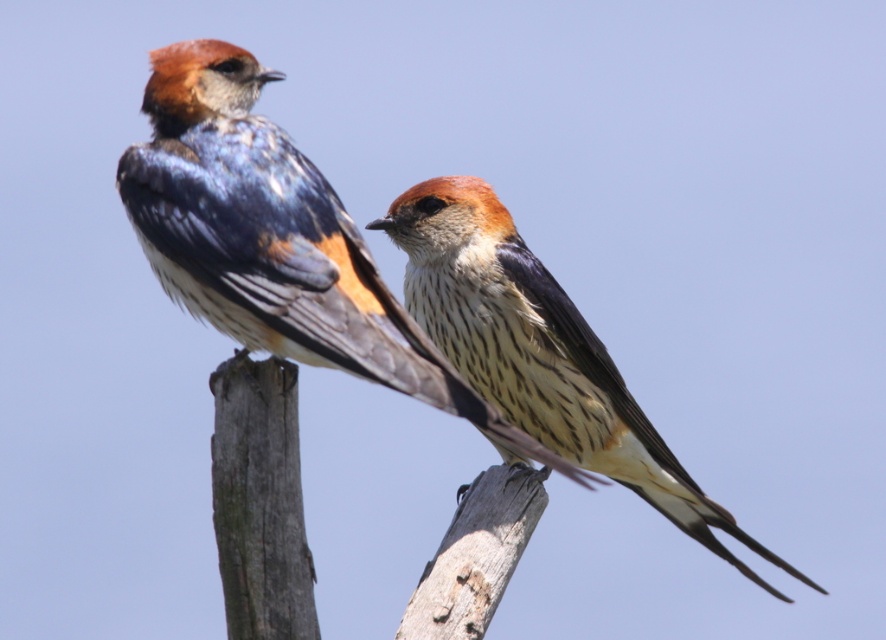
You are a birdwatcher observing two birds on wooden posts. You notice the speckled feathered swallow at center and the speckled feathered bird at center. Which bird is closer to you?

The speckled feathered swallow at center is closer to you because it is in front of the speckled feathered bird at center.

You are an ornithologist studying the positioning of birds in their natural habitat. You observe a speckled feathered swallow at center in an image. Can you determine its exact 2D coordinates in the image?

The speckled feathered swallow at center is located at the 2D coordinates of point (274, 240).

You are a birdwatcher observing two birds on wooden posts. You notice the speckled feathered swallow at center and the speckled feathered bird at center. Which bird is located higher in the image?

The speckled feathered swallow at center is positioned over the speckled feathered bird at center, so it is higher in the image.